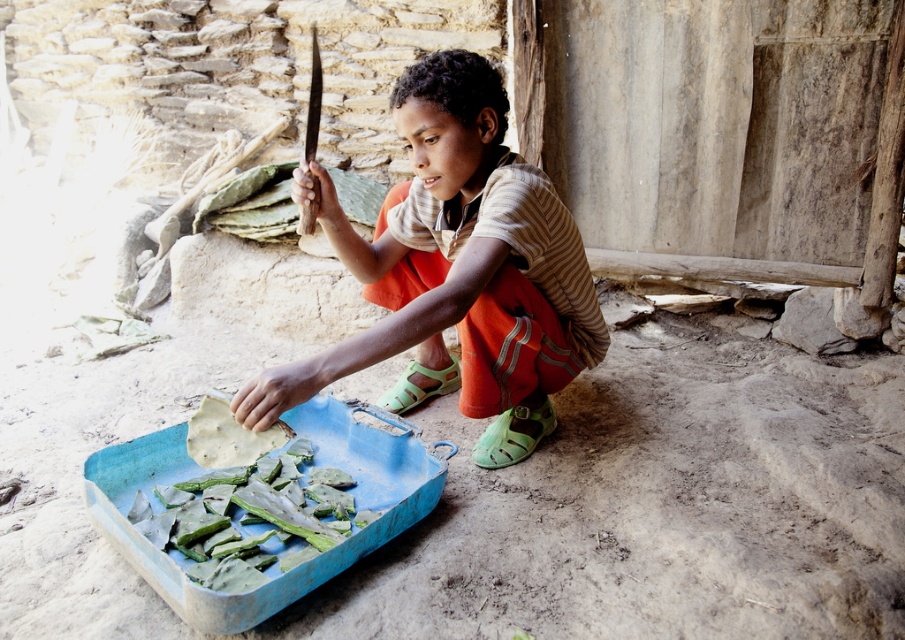
You are a parent supervising your child in the garden. Your child is holding the matte wooden knife at center and has the green matte leaves at lower left nearby. You need to ensure the knife is safe for use. Since the knife is taller than the leaves, does this mean the knife is longer than the leaves?

The matte wooden knife at center is taller than green matte leaves at lower left, so yes, the knife is longer than the leaves.

You are a chef observing a child in a rural area preparing food. The child has a matte wooden knife at center and green matte leaves at lower left. Which object is bigger?

The matte wooden knife at center is larger in size than green matte leaves at lower left.